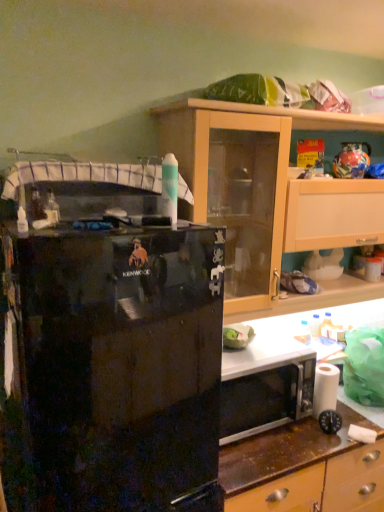
Question: From the image's perspective, is black glossy refrigerator at left located above or below light wood cabinet at upper right?

Choices:
 (A) below
 (B) above

Answer: (A)

Question: Considering the positions of point (71, 416) and point (294, 225), is point (71, 416) closer or farther from the camera than point (294, 225)?

Choices:
 (A) closer
 (B) farther

Answer: (A)

Question: Estimate the real-world distances between objects in this image. Which object is farther from the black glossy refrigerator at left?

Choices:
 (A) light wood cabinet at upper right
 (B) white matte toilet paper at lower right

Answer: (B)

Question: Estimate the real-world distances between objects in this image. Which object is farther from the black glossy refrigerator at left?

Choices:
 (A) light wood cabinet at upper right
 (B) white matte toilet paper at lower right

Answer: (B)